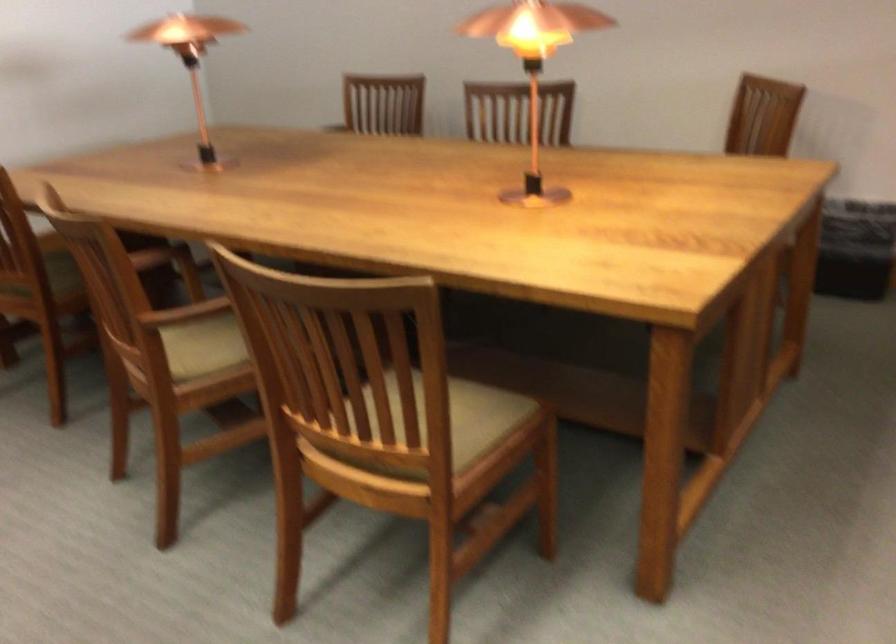
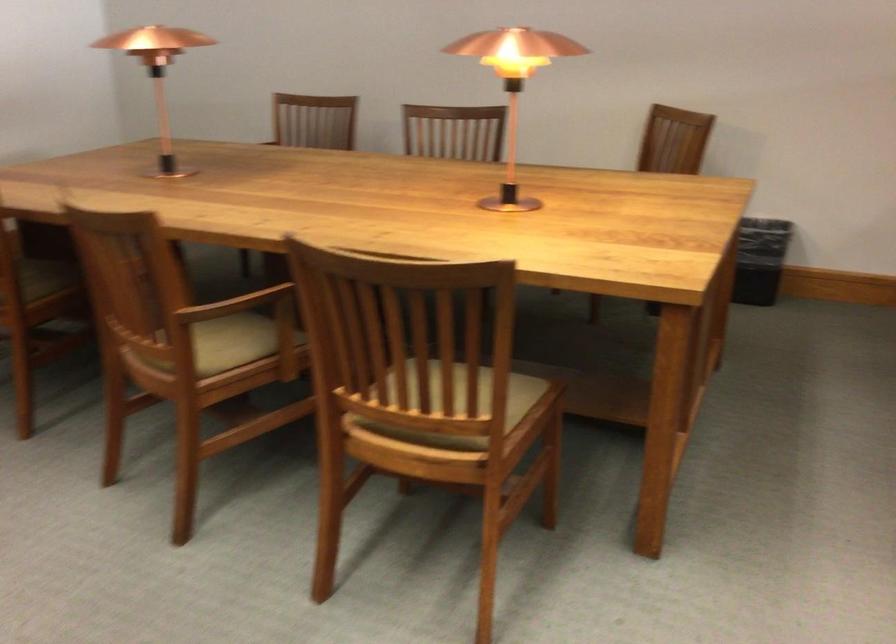
Question: The first image is from the beginning of the video and the second image is from the end. How did the camera likely rotate when shooting the video?

Choices:
 (A) Left
 (B) Right
 (C) Up
 (D) Down

Answer: (B)